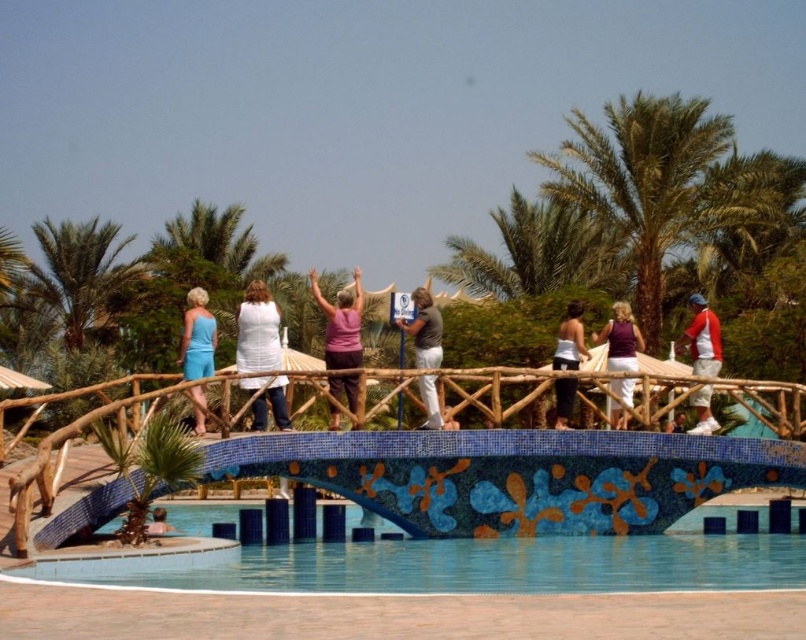
You are a photographer standing at the bridge in the image. You want to take a photo that includes both the green leafy palm tree at upper left and the matte blue dress at left. Considering their distance, will you be able to capture both in a single frame without moving your camera position?

The green leafy palm tree at upper left and matte blue dress at left are 135.91 feet apart. Since the distance between them is significant, it might be challenging to capture both in a single frame without moving the camera position. Adjusting the camera angle or using a wider lens could help, but the photographer might need to check the framing carefully.

You are a photographer taking a picture of the scene. You want to ensure that both the green leafy palm tree at upper right and the white tank top at center are clearly visible in your photo. Which object should you adjust your focus on to prioritize visibility?

The white tank top at center is behind the green leafy palm tree at upper right, so you should focus on the white tank top at center to ensure it appears clearly in front of the palm tree.

You are a photographer standing at the edge of the decorative bridge in the resort scene. You want to capture a photo of the violet fabric dress at center. Where should you position yourself to ensure the dress is centered in your camera frame?

To center the violet fabric dress at center in your camera frame, position yourself directly in line with its 2D coordinates at point (620, 339).